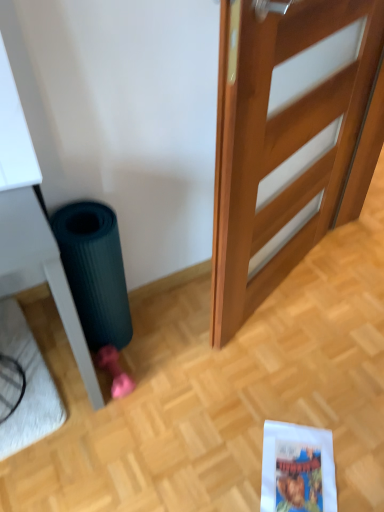
Question: Is blue glossy comic book at lower right to the left or to the right of dark green rubber mat at lower left in the image?

Choices:
 (A) right
 (B) left

Answer: (A)

Question: Is blue glossy comic book at lower right in front of or behind dark green rubber mat at lower left in the image?

Choices:
 (A) behind
 (B) front

Answer: (A)

Question: Based on their relative distances, which object is farther from the blue glossy comic book at lower right?

Choices:
 (A) wooden door at center
 (B) dark green rubber mat at lower left
 (C) white plush doormat at lower left

Answer: (C)

Question: Considering the real-world distances, which object is closest to the wooden door at center?

Choices:
 (A) blue glossy comic book at lower right
 (B) white plush doormat at lower left
 (C) dark green rubber mat at lower left

Answer: (C)